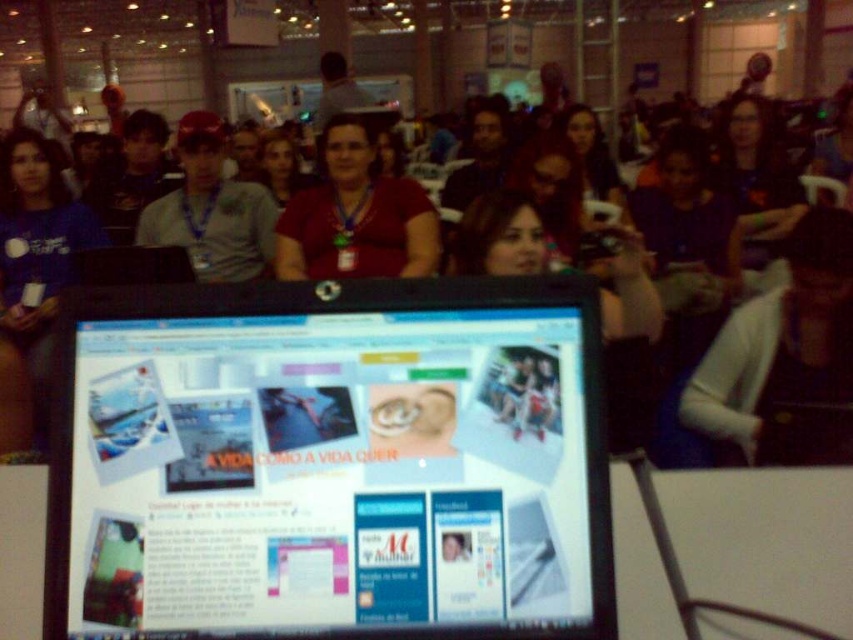
Does matte black monitor at center come behind white sweater at center?

No, it is not.

Between matte black monitor at center and white sweater at center, which one is positioned higher?

white sweater at center is above.

Locate an element on the screen. The width and height of the screenshot is (853, 640). matte black monitor at center is located at coordinates (332, 464).

This screenshot has height=640, width=853. What are the coordinates of `matte black monitor at center` in the screenshot? It's located at (332, 464).

Does matte black monitor at center lie behind gray cotton shirt at left?

No, it is in front of gray cotton shirt at left.

Which is behind, point (596, 381) or point (219, 212)?

Positioned behind is point (219, 212).

You are a GUI agent. You are given a task and a screenshot of the screen. Output one action in this format:
    pyautogui.click(x=<x>, y=<y>)
    Task: Click on the matte black monitor at center
    The height and width of the screenshot is (640, 853).
    Given the screenshot: What is the action you would take?
    pyautogui.click(x=332, y=464)

Is white sweater at center wider than gray cotton shirt at left?

No.

Can you confirm if white sweater at center is bigger than gray cotton shirt at left?

Incorrect, white sweater at center is not larger than gray cotton shirt at left.

This screenshot has width=853, height=640. Find the location of `white sweater at center`. white sweater at center is located at coordinates (780, 342).